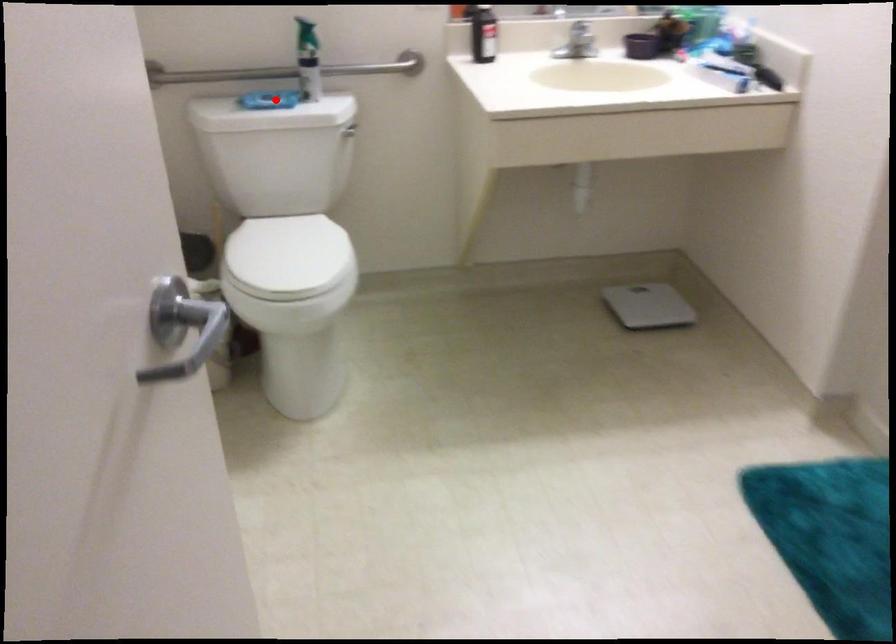
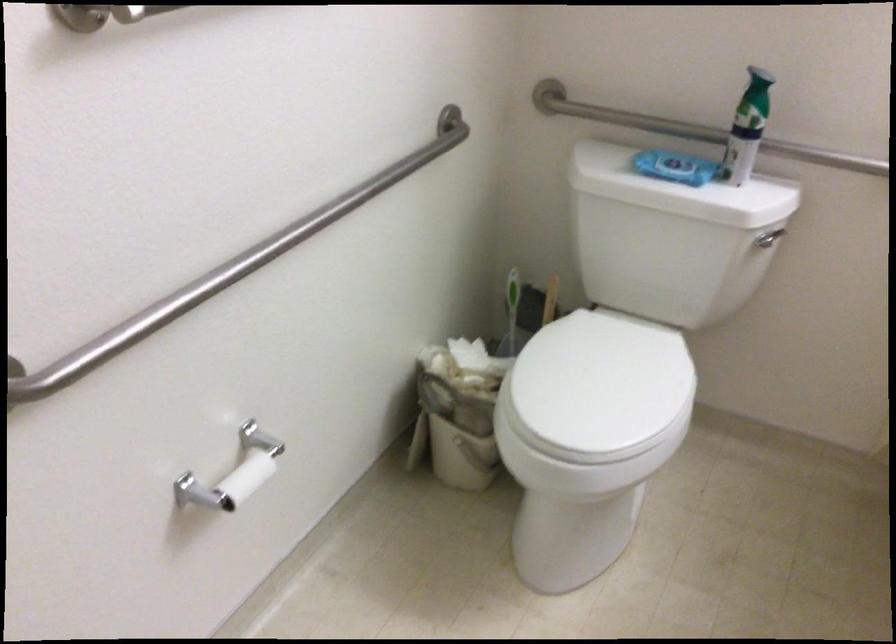
Question: I am providing you with two images of the same scene from different viewpoints. Image1 has a red point marked. In image2, the corresponding 3D location appears at what relative position? Reply with the corresponding letter.

Choices:
 (A) Closer
 (B) Farther

Answer: (A)